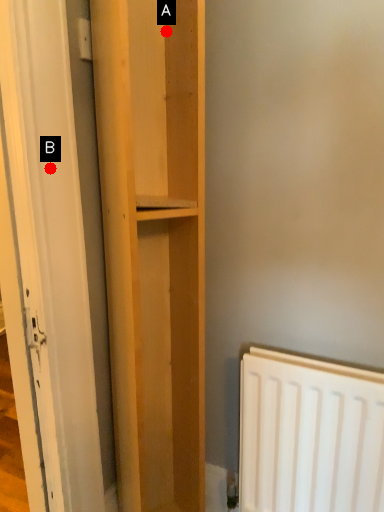
Question: Two points are circled on the image, labeled by A and B beside each circle. Which point is closer to the camera?

Choices:
 (A) A is closer
 (B) B is closer

Answer: (B)